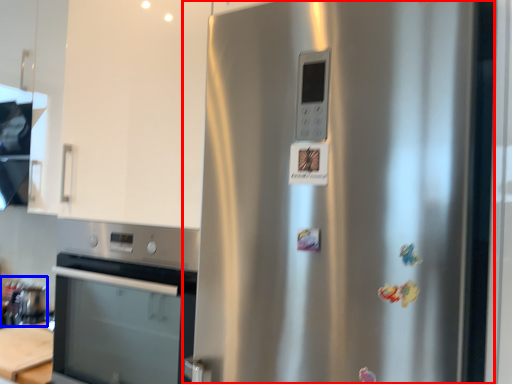
Question: Which point is closer to the camera, refrigerator (highlighted by a red box) or appliance (highlighted by a blue box)?

Choices:
 (A) refrigerator
 (B) appliance

Answer: (A)